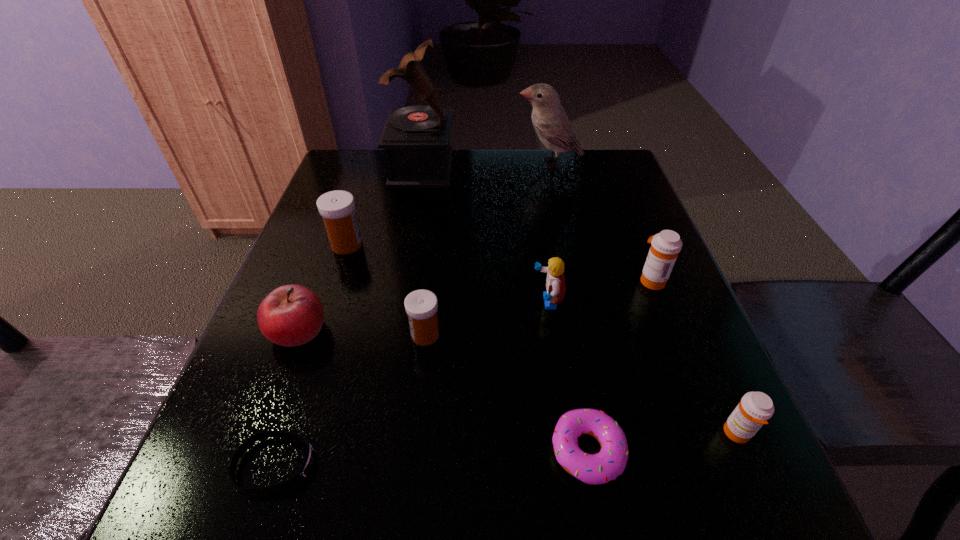
Locate an element on the screen. the tallest object is located at coordinates (416, 139).

Find the location of a particular element. the second tallest object is located at coordinates (550, 121).

Identify the location of white bird. (550, 121).

The width and height of the screenshot is (960, 540). I want to click on the leftmost medicine, so click(337, 208).

Identify the location of the farther white medicine. (337, 208).

At what (x,y) coordinates should I click in order to perform the action: click on the farther orange medicine. Please return your answer as a coordinate pair (x, y). The height and width of the screenshot is (540, 960). Looking at the image, I should click on (665, 246).

Where is `the second farthest medicine`? the second farthest medicine is located at coordinates point(665,246).

I want to click on Lego, so click(555, 282).

At what (x,y) coordinates should I click in order to perform the action: click on apple. Please return your answer as a coordinate pair (x, y). The image size is (960, 540). Looking at the image, I should click on (291, 315).

Identify the location of the nearer white medicine. (421, 306).